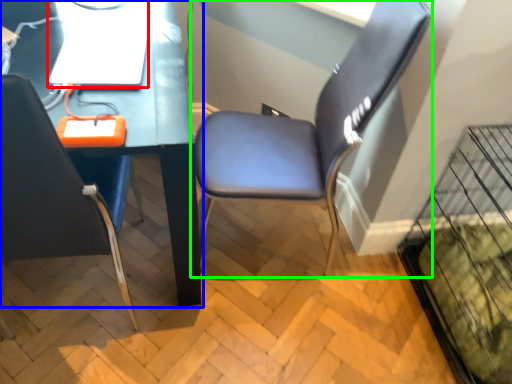
Question: Estimate the real-world distances between objects in this image. Which object is closer to computer (highlighted by a red box), computer desk (highlighted by a blue box) or chair (highlighted by a green box)?

Choices:
 (A) computer desk
 (B) chair

Answer: (A)